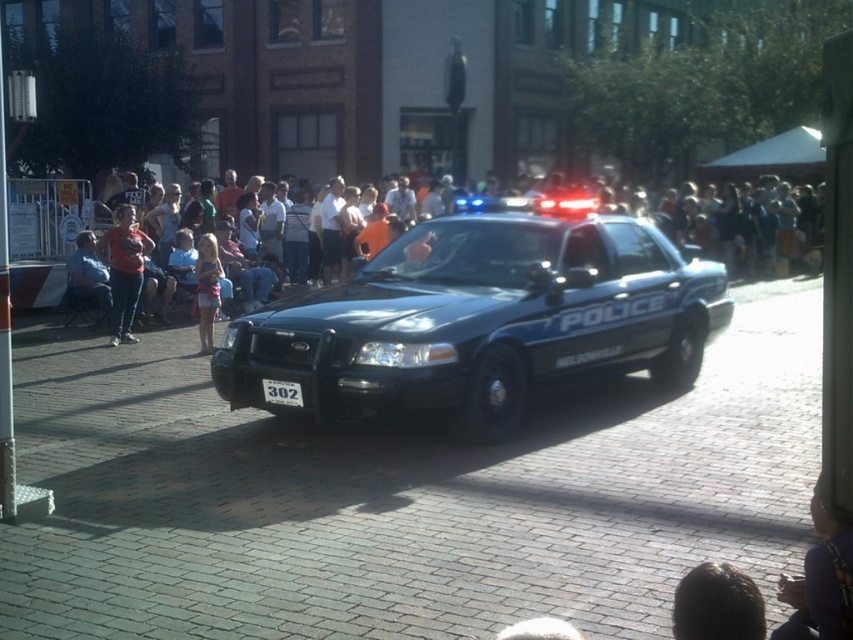
Question: Is purple fabric at center wider than light pink fabric dress at center?

Choices:
 (A) yes
 (B) no

Answer: (B)

Question: Among these points, which one is nearest to the camera?

Choices:
 (A) (672, 266)
 (B) (245, 188)

Answer: (A)

Question: Which point is farther to the camera?

Choices:
 (A) (212, 291)
 (B) (576, 278)
 (C) (103, 241)

Answer: (C)

Question: In this image, where is glossy black police car at center located relative to purple fabric at center?

Choices:
 (A) below
 (B) above

Answer: (B)

Question: Is purple fabric at center bigger than matte red shirt at left?

Choices:
 (A) yes
 (B) no

Answer: (B)

Question: Which object appears farthest from the camera in this image?

Choices:
 (A) matte red shirt at left
 (B) purple fabric at center
 (C) light pink fabric dress at center

Answer: (A)